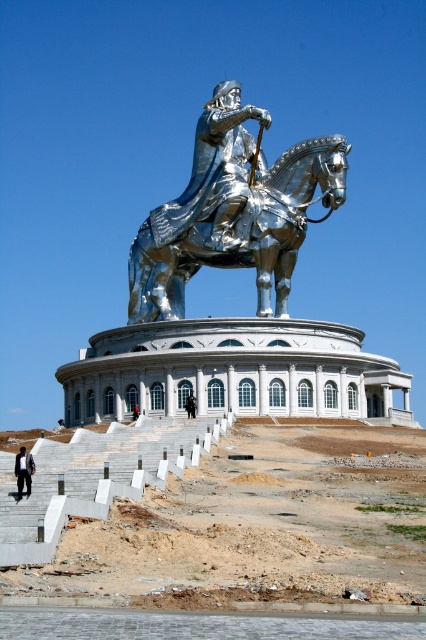
Does white marble palace at center have a larger size compared to dark brown leather coat at center?

Correct, white marble palace at center is larger in size than dark brown leather coat at center.

Which is below, white marble palace at center or dark brown leather coat at center?

dark brown leather coat at center is below.

Which is behind, point (209, 369) or point (187, 406)?

Point (209, 369)

Where is `white marble palace at center`? The image size is (426, 640). white marble palace at center is located at coordinates (232, 371).

Between black suit at lower left and brushed metal helmet at upper center, which one is positioned higher?

black suit at lower left is above.

Who is lower down, black suit at lower left or brushed metal helmet at upper center?

→ Positioned lower is brushed metal helmet at upper center.

Is point (20, 467) farther from viewer compared to point (134, 412)?

No.

The height and width of the screenshot is (640, 426). Identify the location of black suit at lower left. (23, 472).

Between shiny chrome horse at center and brushed metal helmet at upper center, which one is positioned lower?

brushed metal helmet at upper center is below.

Can you confirm if shiny chrome horse at center is positioned to the left of brushed metal helmet at upper center?

No, shiny chrome horse at center is not to the left of brushed metal helmet at upper center.

Between point (210, 216) and point (135, 403), which one is positioned in front?

Point (135, 403) is in front.

Find the location of a particular element. This screenshot has height=640, width=426. shiny chrome horse at center is located at coordinates (239, 234).